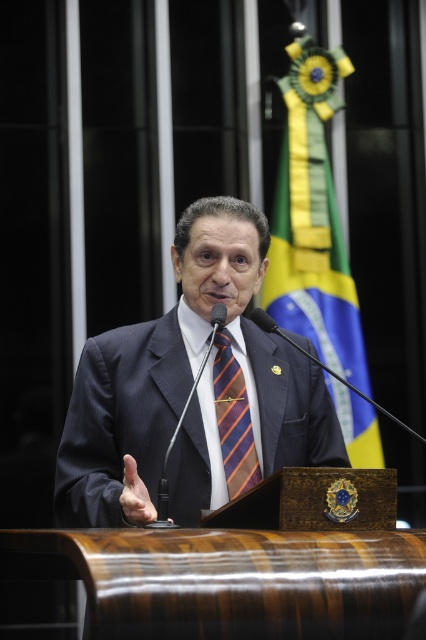
Question: Does dark blue suit at center have a greater width compared to orange striped tie at center?

Choices:
 (A) no
 (B) yes

Answer: (B)

Question: Is yellow-green fabric flag at upper center smaller than orange striped tie at center?

Choices:
 (A) no
 (B) yes

Answer: (A)

Question: Among these points, which one is farthest from the camera?

Choices:
 (A) (291, 147)
 (B) (239, 394)

Answer: (A)

Question: Can you confirm if dark blue suit at center is positioned to the right of orange striped tie at center?

Choices:
 (A) no
 (B) yes

Answer: (A)

Question: Estimate the real-world distances between objects in this image. Which object is closer to the yellow-green fabric flag at upper center?

Choices:
 (A) orange striped tie at center
 (B) dark blue suit at center

Answer: (B)

Question: Which object is farther from the camera taking this photo?

Choices:
 (A) orange striped tie at center
 (B) yellow-green fabric flag at upper center

Answer: (B)